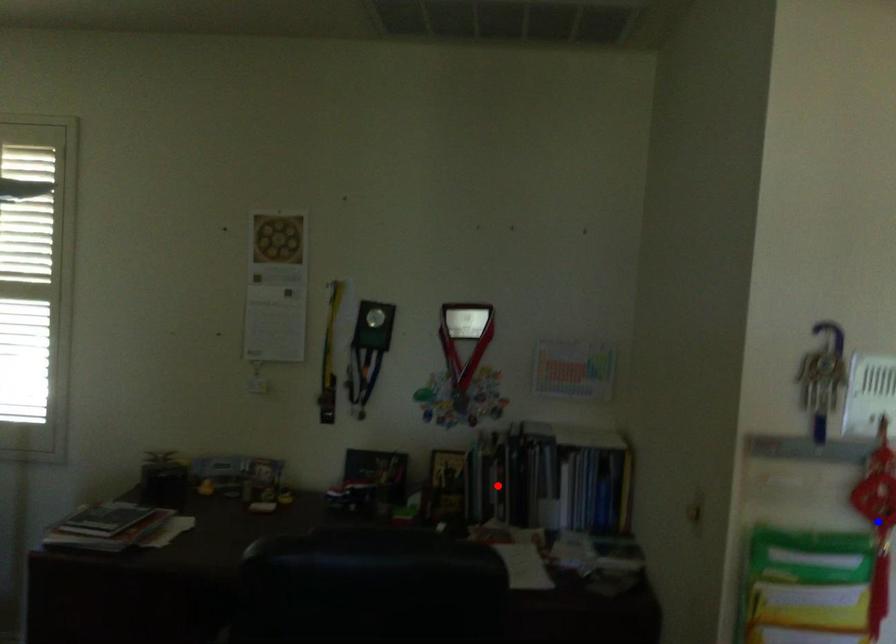
Question: Two points are marked on the image. Which point is closer to the camera?

Choices:
 (A) Blue point is closer.
 (B) Red point is closer.

Answer: (A)